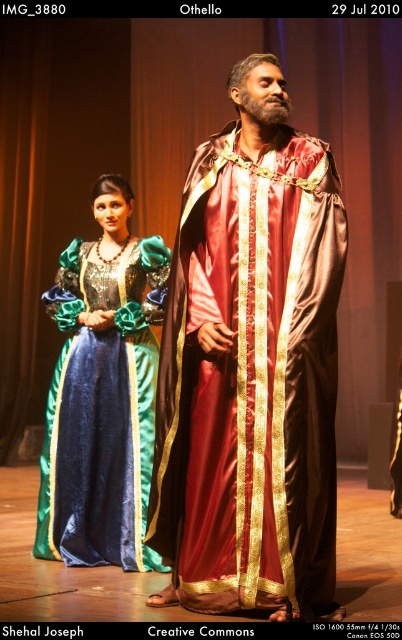
You are an audience member sitting in the front row of the theater. You notice two points on the stage during the play. The first point is at coordinate point(x=317, y=145) and the second is at point(x=57, y=506). Which point is closer to you?

Point(x=317, y=145) is closer to the viewer than point(x=57, y=506).

You are a stagehand preparing to place a 1.2 meter wide prop behind both the satin gold robe at center and the velvet green dress at center. Based on their widths, which character requires more space to the left and right?

The satin gold robe at center requires more space to the left and right because its width surpasses that of the velvet green dress at center.

In the scene shown: You are a stagehand preparing to lower a trapdoor beneath the velvet green dress at center. Based on the scene description, will the trapdoor also be under the satin gold robe at center?

The satin gold robe at center is above the velvet green dress at center, so the trapdoor beneath the velvet green dress at center will not be under the satin gold robe at center.